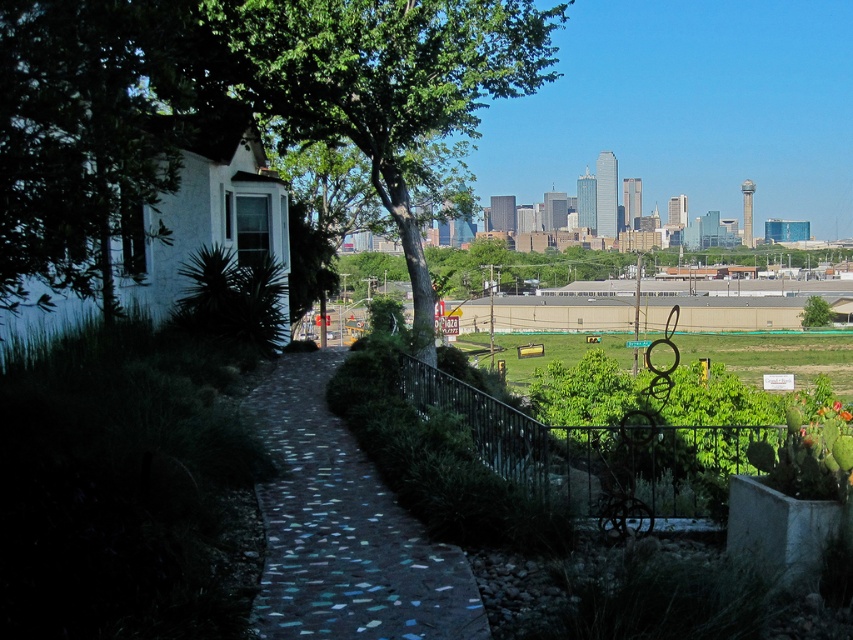
Looking at this image, is the position of green leafy tree at center less distant than that of mosaic stone path at center?

No, it is not.

What are the coordinates of `green leafy tree at center` in the screenshot? It's located at coord(387,90).

Between mosaic stone path at center and green leafy tree at upper center, which one has less height?

Standing shorter between the two is mosaic stone path at center.

Which is in front, point (305, 515) or point (821, 298)?

Positioned in front is point (305, 515).

The height and width of the screenshot is (640, 853). What do you see at coordinates (344, 529) in the screenshot?
I see `mosaic stone path at center` at bounding box center [344, 529].

I want to click on mosaic stone path at center, so click(x=344, y=529).

Who is higher up, green leafy tree at center or green leafy tree at upper center?

green leafy tree at center is higher up.

Is green leafy tree at center wider than green leafy tree at upper center?

Yes, green leafy tree at center is wider than green leafy tree at upper center.

Measure the distance between green leafy tree at center and camera.

green leafy tree at center is 53.32 feet from camera.

Identify the location of green leafy tree at center. (387, 90).